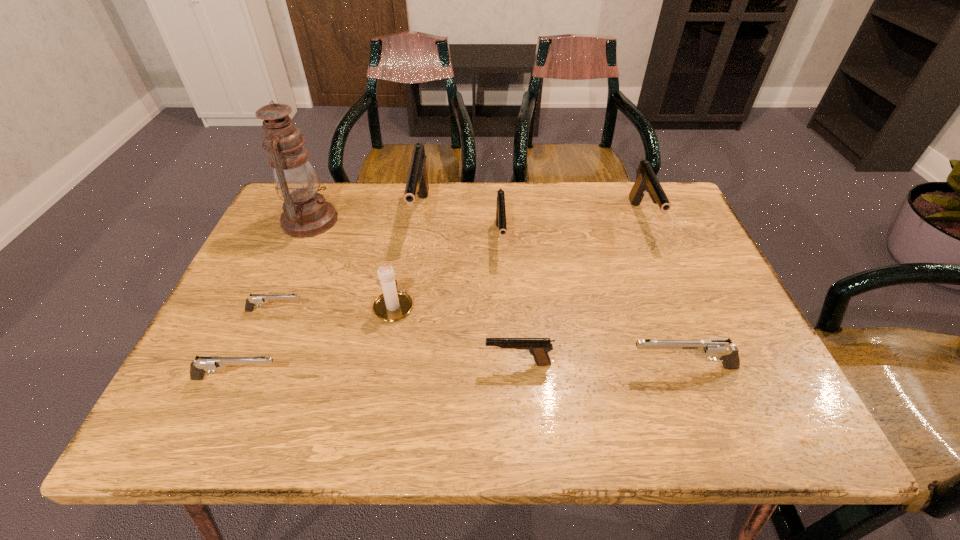
The height and width of the screenshot is (540, 960). I want to click on vacant space located on the handle side of the candle holder, so click(405, 245).

Where is `free location located 0.210m at the muzzle of the fifth shortest pistol`? The image size is (960, 540). free location located 0.210m at the muzzle of the fifth shortest pistol is located at coordinates (506, 328).

I want to click on vacant space located 0.320m on the front-facing side of the biggest silver pistol, so click(470, 367).

Locate an element on the screen. The height and width of the screenshot is (540, 960). vacant space located 0.170m on the front-facing side of the biggest silver pistol is located at coordinates (544, 367).

Where is `vacant space situated on the front-facing side of the biggest silver pistol`? vacant space situated on the front-facing side of the biggest silver pistol is located at coordinates (505, 367).

Where is `vacant region located 0.080m at the muzzle of the smallest black pistol`? The height and width of the screenshot is (540, 960). vacant region located 0.080m at the muzzle of the smallest black pistol is located at coordinates (445, 364).

Where is `vacant space located at the muzzle of the smallest black pistol`? The image size is (960, 540). vacant space located at the muzzle of the smallest black pistol is located at coordinates pyautogui.click(x=441, y=364).

Where is `vacant space situated at the muzzle of the smallest black pistol`? The width and height of the screenshot is (960, 540). vacant space situated at the muzzle of the smallest black pistol is located at coordinates (314, 364).

Where is `free location located on the front-facing side of the nearest pistol`? This screenshot has height=540, width=960. free location located on the front-facing side of the nearest pistol is located at coordinates (397, 379).

This screenshot has width=960, height=540. What are the coordinates of `free space located 0.200m on the front-facing side of the farthest silver pistol` in the screenshot? It's located at (393, 310).